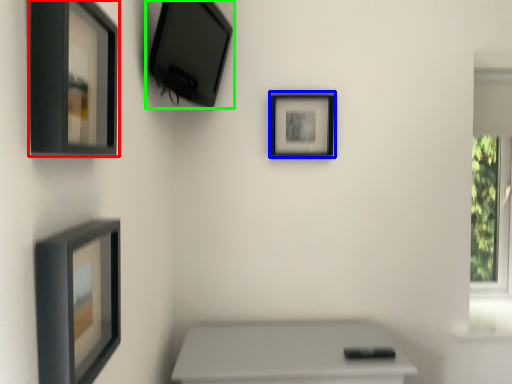
Question: Estimate the real-world distances between objects in this image. Which object is closer to picture frame (highlighted by a red box), picture frame (highlighted by a blue box) or picture frame (highlighted by a green box)?

Choices:
 (A) picture frame
 (B) picture frame

Answer: (B)